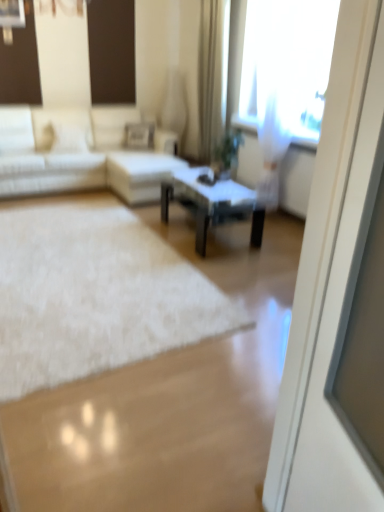
Where is `free spot below white fluffy rug at center (from a real-world perspective)`? The image size is (384, 512). free spot below white fluffy rug at center (from a real-world perspective) is located at coordinates (78, 261).